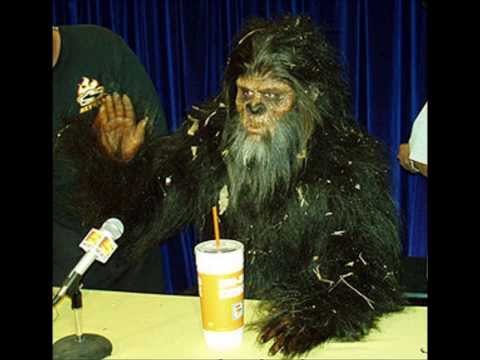
Identify the location of cup. Image resolution: width=480 pixels, height=360 pixels. (222, 301).